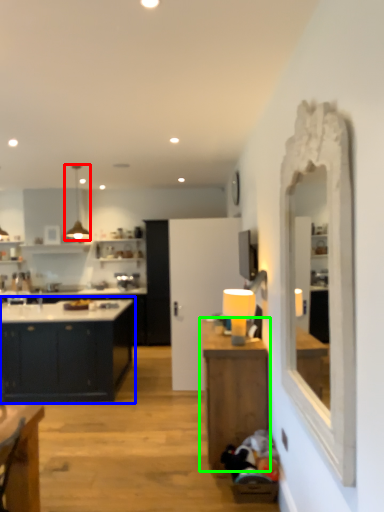
Question: Which is nearer to the light fixture (highlighted by a red box)? cabinetry (highlighted by a blue box) or table (highlighted by a green box).

Choices:
 (A) cabinetry
 (B) table

Answer: (A)